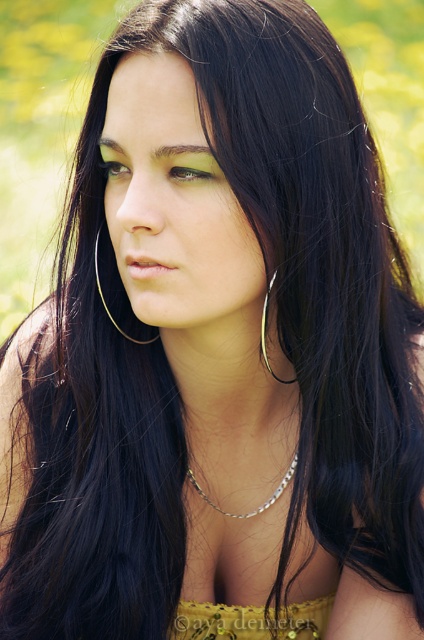
Between yellow lace dress at center and silver metallic chain at center, which one appears on the right side from the viewer's perspective?

From the viewer's perspective, yellow lace dress at center appears more on the right side.

The image size is (424, 640). Describe the element at coordinates (251, 620) in the screenshot. I see `yellow lace dress at center` at that location.

Is point (178, 627) closer to camera compared to point (245, 515)?

Yes, it is.

The height and width of the screenshot is (640, 424). I want to click on yellow lace dress at center, so click(251, 620).

Does gold metallic hoop at center have a greater width compared to brown shiny eye at upper center?

Yes.

Between point (147, 340) and point (123, 166), which one is positioned behind?

Point (147, 340)

Does point (153, 337) come farther from viewer compared to point (103, 170)?

Yes, it is behind point (103, 170).

I want to click on gold metallic hoop at center, so click(105, 300).

Measure the distance between point (220, 170) and camera.

Point (220, 170) is 33.35 inches away from camera.

Can you confirm if brown matte eye at center is wider than silver metallic hoop earring at center-left?

Yes, brown matte eye at center is wider than silver metallic hoop earring at center-left.

Is point (209, 168) in front of point (270, 284)?

Yes, point (209, 168) is in front of point (270, 284).

At what (x,y) coordinates should I click in order to perform the action: click on brown matte eye at center. Please return your answer as a coordinate pair (x, y). Looking at the image, I should click on (195, 168).